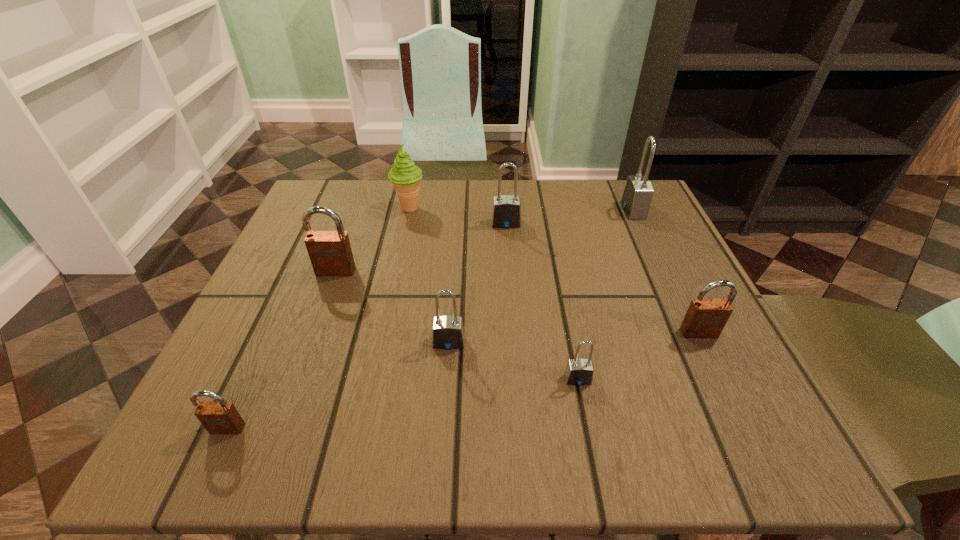
Where is `free point between the rightmost brown padlock and the icecream`? The width and height of the screenshot is (960, 540). free point between the rightmost brown padlock and the icecream is located at coordinates pos(554,271).

I want to click on free spot between the third biggest gray padlock and the fourth padlock from right to left, so click(477, 283).

In order to click on vacant point located between the third biggest gray padlock and the nearest gray padlock in this screenshot , I will do `click(514, 361)`.

You are a GUI agent. You are given a task and a screenshot of the screen. Output one action in this format:
    pyautogui.click(x=<x>, y=<y>)
    Task: Click on the blank region between the sixth object from right to left and the nearest object
    
    Given the screenshot: What is the action you would take?
    pyautogui.click(x=318, y=318)

Identify the location of free space between the second smallest brown padlock and the third padlock from left to right. (574, 338).

Locate which object is the closest to the sixth object from right to left. Please provide its 2D coordinates. Your answer should be formatted as a tuple, i.e. [(x, y)], where the tuple contains the x and y coordinates of a point satisfying the conditions above.

[(506, 210)]

Point out which object is positioned as the fourth nearest to the second biggest brown padlock. Please provide its 2D coordinates. Your answer should be formatted as a tuple, i.e. [(x, y)], where the tuple contains the x and y coordinates of a point satisfying the conditions above.

[(506, 210)]

What are the coordinates of `padlock that is the fifth closest one to the biggest gray padlock` in the screenshot? It's located at (330, 253).

Identify which padlock is the sixth nearest to the fourth padlock from right to left. Please provide its 2D coordinates. Your answer should be formatted as a tuple, i.e. [(x, y)], where the tuple contains the x and y coordinates of a point satisfying the conditions above.

[(221, 417)]

This screenshot has width=960, height=540. I want to click on gray padlock that can be found as the third closest to the nearest padlock, so click(506, 210).